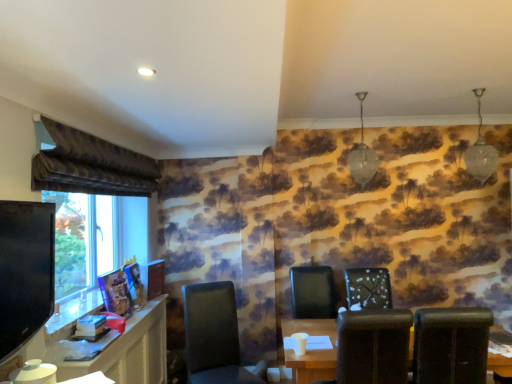
Question: Is matte brown table at lower center aimed at matte black computer desk at lower left?

Choices:
 (A) no
 (B) yes

Answer: (A)

Question: Does matte brown table at lower center have a greater width compared to matte black computer desk at lower left?

Choices:
 (A) yes
 (B) no

Answer: (A)

Question: Is matte black computer desk at lower left at the back of matte brown table at lower center?

Choices:
 (A) yes
 (B) no

Answer: (B)

Question: Considering the relative sizes of matte brown table at lower center and matte black computer desk at lower left in the image provided, is matte brown table at lower center shorter than matte black computer desk at lower left?

Choices:
 (A) yes
 (B) no

Answer: (A)

Question: Can you confirm if matte brown table at lower center is thinner than matte black computer desk at lower left?

Choices:
 (A) yes
 (B) no

Answer: (B)

Question: Would you say velvet brown curtain at upper left is inside or outside black glossy tv at left?

Choices:
 (A) outside
 (B) inside

Answer: (A)

Question: Does point (104, 168) appear closer or farther from the camera than point (16, 329)?

Choices:
 (A) closer
 (B) farther

Answer: (B)

Question: Is velvet brown curtain at upper left taller or shorter than black glossy tv at left?

Choices:
 (A) short
 (B) tall

Answer: (A)

Question: Considering their positions, is velvet brown curtain at upper left located in front of or behind black glossy tv at left?

Choices:
 (A) behind
 (B) front

Answer: (A)

Question: From the image's perspective, is matte black computer desk at lower left above or below matte brown table at lower center?

Choices:
 (A) below
 (B) above

Answer: (A)

Question: Considering the positions of matte black computer desk at lower left and matte brown table at lower center in the image, is matte black computer desk at lower left wider or thinner than matte brown table at lower center?

Choices:
 (A) thin
 (B) wide

Answer: (A)

Question: Do you think matte black computer desk at lower left is within matte brown table at lower center, or outside of it?

Choices:
 (A) outside
 (B) inside

Answer: (A)

Question: Considering the positions of point click(x=115, y=350) and point click(x=287, y=331), is point click(x=115, y=350) closer or farther from the camera than point click(x=287, y=331)?

Choices:
 (A) farther
 (B) closer

Answer: (B)

Question: Considering the relative positions of matte black chair at center, which is the 1th chair from left to right, and black glossy tv at left in the image provided, is matte black chair at center, which is the 1th chair from left to right, to the left or to the right of black glossy tv at left?

Choices:
 (A) left
 (B) right

Answer: (B)

Question: From a real-world perspective, relative to black glossy tv at left, is matte black chair at center, which is the 1th chair from left to right, vertically above or below?

Choices:
 (A) above
 (B) below

Answer: (B)